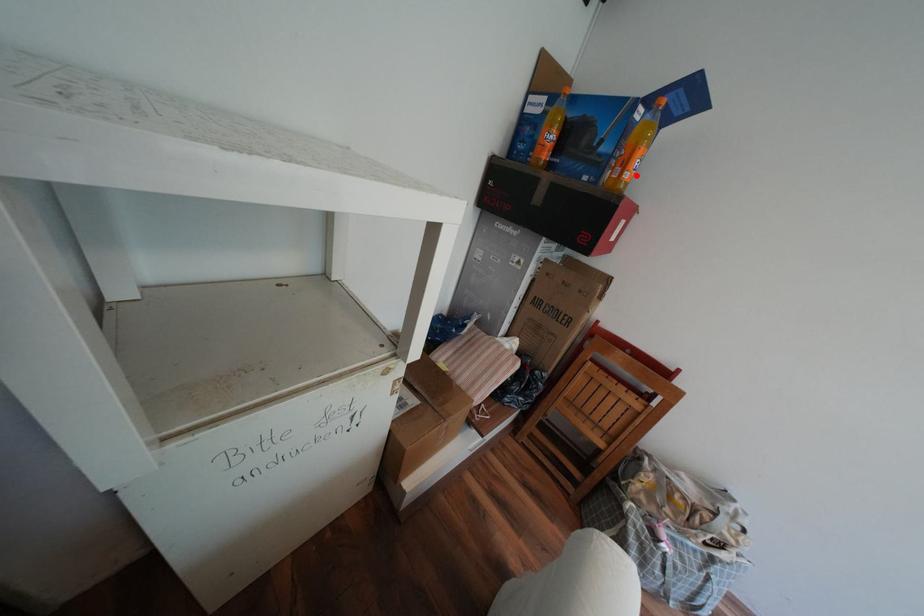
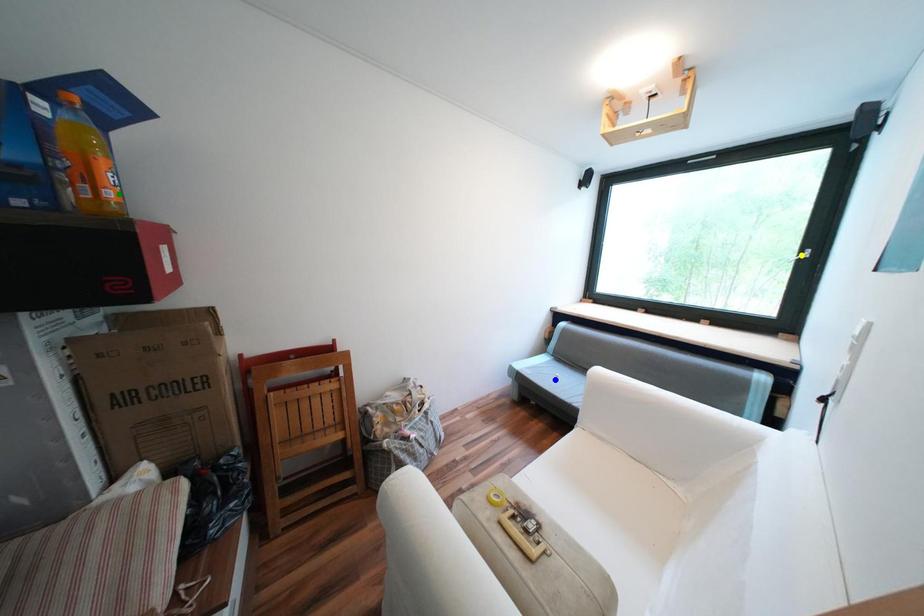
Question: I am providing you with two images of the same scene from different viewpoints. A red point is marked on the first image. You are given multiple points on the second image. Can you choose the point in image 2 that corresponds to the point in image 1?

Choices:
 (A) green point
 (B) blue point
 (C) yellow point

Answer: (A)